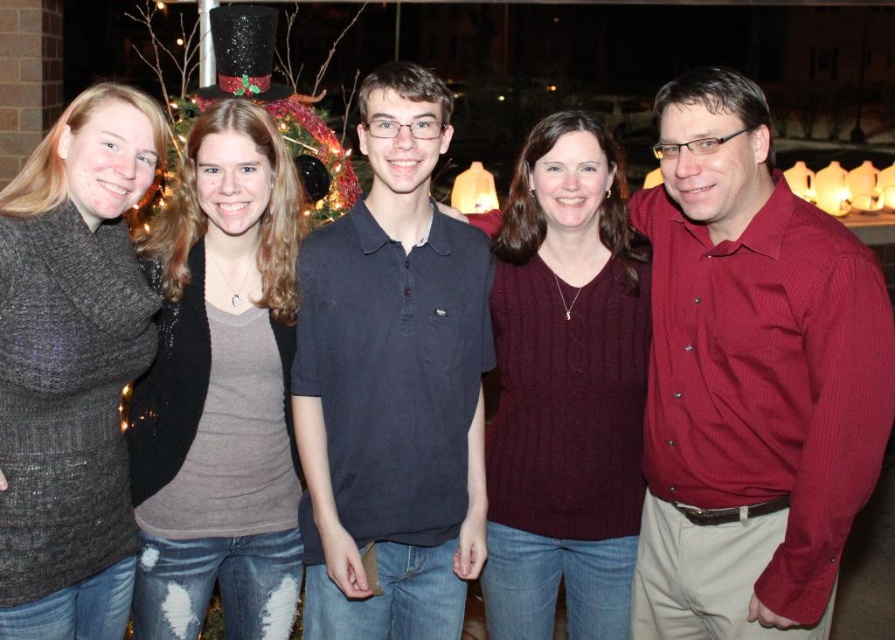
Does point (125, 186) lie in front of point (260, 61)?

Yes.

Describe the element at coordinates (72, 365) in the screenshot. I see `dark gray knitted sweater at left` at that location.

This screenshot has height=640, width=895. Identify the location of dark gray knitted sweater at left. (72, 365).

Does cable-knit sweater at center appear on the left side of dark gray knitted sweater at left?

Incorrect, cable-knit sweater at center is not on the left side of dark gray knitted sweater at left.

Does cable-knit sweater at center have a larger size compared to dark gray knitted sweater at left?

Indeed, cable-knit sweater at center has a larger size compared to dark gray knitted sweater at left.

Which is in front, point (531, 221) or point (131, 132)?

Point (131, 132)

Find the location of a particular element. cable-knit sweater at center is located at coordinates (565, 388).

Looking at this image, between matte gray shirt at center and glittering plastic christmas light at upper center, which one is positioned higher?

glittering plastic christmas light at upper center is above.

Locate an element on the screen. This screenshot has height=640, width=895. matte gray shirt at center is located at coordinates (220, 388).